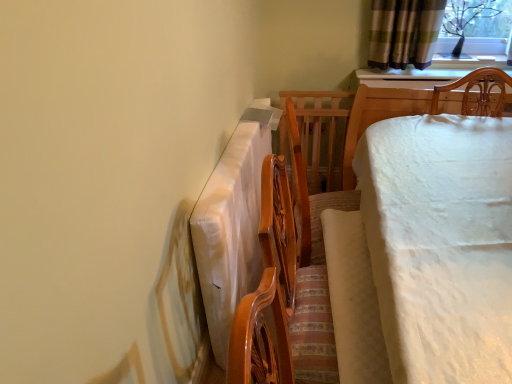
Question: Does white fabric-covered bed at right have a greater height compared to light beige fabric at center?

Choices:
 (A) no
 (B) yes

Answer: (B)

Question: Does white fabric-covered bed at right have a lesser height compared to light beige fabric at center?

Choices:
 (A) no
 (B) yes

Answer: (A)

Question: Is white fabric-covered bed at right not inside light beige fabric at center?

Choices:
 (A) yes
 (B) no

Answer: (A)

Question: From the image's perspective, is white fabric-covered bed at right over light beige fabric at center?

Choices:
 (A) yes
 (B) no

Answer: (B)

Question: Considering the relative positions of white fabric-covered bed at right and light beige fabric at center in the image provided, is white fabric-covered bed at right to the right of light beige fabric at center from the viewer's perspective?

Choices:
 (A) no
 (B) yes

Answer: (B)

Question: Is the position of white fabric-covered bed at right less distant than that of light beige fabric at center?

Choices:
 (A) yes
 (B) no

Answer: (A)

Question: Is light beige fabric at center closer to the viewer compared to clear glass window screen at upper right?

Choices:
 (A) no
 (B) yes

Answer: (B)

Question: Is light beige fabric at center far away from clear glass window screen at upper right?

Choices:
 (A) no
 (B) yes

Answer: (B)

Question: From a real-world perspective, is light beige fabric at center physically below clear glass window screen at upper right?

Choices:
 (A) no
 (B) yes

Answer: (B)

Question: From the image's perspective, is light beige fabric at center under clear glass window screen at upper right?

Choices:
 (A) no
 (B) yes

Answer: (B)

Question: Is light beige fabric at center oriented towards clear glass window screen at upper right?

Choices:
 (A) yes
 (B) no

Answer: (B)

Question: From a real-world perspective, is light beige fabric at center located higher than clear glass window screen at upper right?

Choices:
 (A) yes
 (B) no

Answer: (B)

Question: Is light beige fabric at center at the back of clear glass window screen at upper right?

Choices:
 (A) no
 (B) yes

Answer: (A)